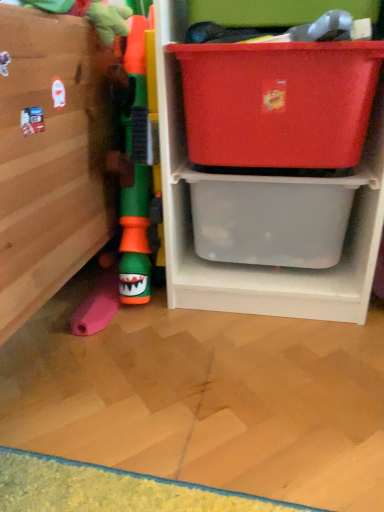
Question: From a real-world perspective, is matte plastic storage box at upper right, the 2th storage box in the bottom-to-top sequence, physically above translucent plastic storage at center?

Choices:
 (A) yes
 (B) no

Answer: (A)

Question: Is translucent plastic storage at center at the back of matte plastic storage box at upper right, placed as the first storage box when sorted from top to bottom?

Choices:
 (A) yes
 (B) no

Answer: (A)

Question: Is matte plastic storage box at upper right, the 2th storage box in the bottom-to-top sequence, to the right of translucent plastic storage at center from the viewer's perspective?

Choices:
 (A) no
 (B) yes

Answer: (A)

Question: Can you confirm if matte plastic storage box at upper right, the 2th storage box in the bottom-to-top sequence, is wider than translucent plastic storage at center?

Choices:
 (A) no
 (B) yes

Answer: (A)

Question: Is matte plastic storage box at upper right, placed as the first storage box when sorted from top to bottom, far away from translucent plastic storage at center?

Choices:
 (A) yes
 (B) no

Answer: (B)

Question: Does matte plastic storage box at upper right, the 2th storage box in the bottom-to-top sequence, have a smaller size compared to translucent plastic storage at center?

Choices:
 (A) yes
 (B) no

Answer: (A)

Question: Does translucent plastic storage at center come behind transparent plastic storage box at lower right, which is the 2th storage box in top-to-bottom order?

Choices:
 (A) yes
 (B) no

Answer: (B)

Question: Is translucent plastic storage at center aimed at transparent plastic storage box at lower right, which is the 2th storage box in top-to-bottom order?

Choices:
 (A) no
 (B) yes

Answer: (B)

Question: Is translucent plastic storage at center placed right next to transparent plastic storage box at lower right, the 1th storage box positioned from the bottom?

Choices:
 (A) no
 (B) yes

Answer: (B)

Question: Does translucent plastic storage at center appear on the right side of transparent plastic storage box at lower right, the 1th storage box positioned from the bottom?

Choices:
 (A) yes
 (B) no

Answer: (A)

Question: Can we say translucent plastic storage at center lies outside transparent plastic storage box at lower right, the 1th storage box positioned from the bottom?

Choices:
 (A) no
 (B) yes

Answer: (B)

Question: From the image's perspective, would you say translucent plastic storage at center is positioned over transparent plastic storage box at lower right, which is the 2th storage box in top-to-bottom order?

Choices:
 (A) no
 (B) yes

Answer: (B)

Question: Is transparent plastic storage box at lower right, which is the 2th storage box in top-to-bottom order, at the left side of matte plastic storage box at upper right, placed as the first storage box when sorted from top to bottom?

Choices:
 (A) no
 (B) yes

Answer: (A)